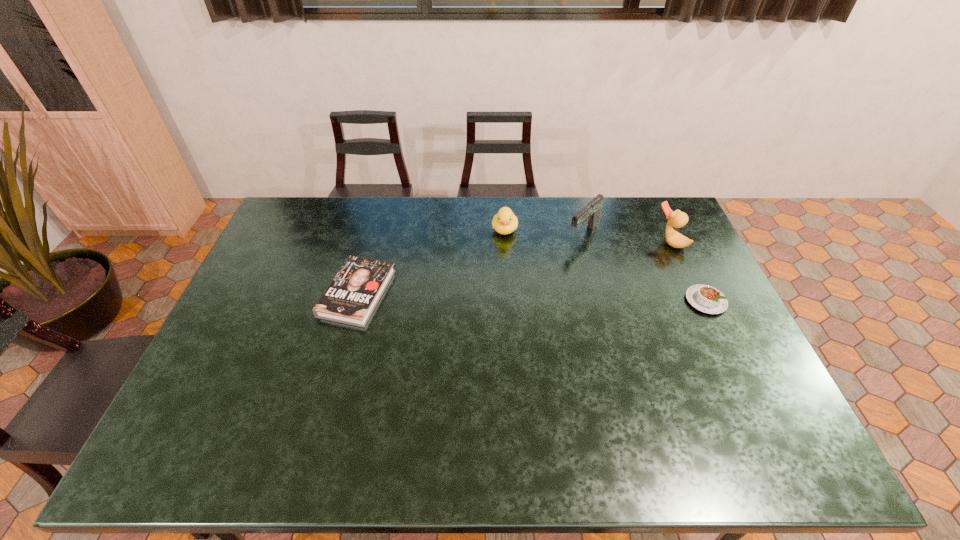
In order to click on duckling located at the far edge in this screenshot , I will do `click(504, 222)`.

At what (x,y) coordinates should I click in order to perform the action: click on pudding positioned at the right edge. Please return your answer as a coordinate pair (x, y). The height and width of the screenshot is (540, 960). Looking at the image, I should click on (707, 299).

You are a GUI agent. You are given a task and a screenshot of the screen. Output one action in this format:
    pyautogui.click(x=<x>, y=<y>)
    Task: Click on the duck located at the right edge
    This screenshot has width=960, height=540.
    Given the screenshot: What is the action you would take?
    pyautogui.click(x=677, y=219)

This screenshot has height=540, width=960. What are the coordinates of `object that is at the far right corner` in the screenshot? It's located at (677, 219).

You are a GUI agent. You are given a task and a screenshot of the screen. Output one action in this format:
    pyautogui.click(x=<x>, y=<y>)
    Task: Click on the free region at the far edge of the desktop
    The height and width of the screenshot is (540, 960).
    Given the screenshot: What is the action you would take?
    pyautogui.click(x=520, y=230)

The width and height of the screenshot is (960, 540). I want to click on vacant area at the near edge, so click(350, 387).

Identify the location of blank space at the left edge of the desktop. (304, 255).

In the image, there is a desktop. Where is `vacant space at the right edge`? vacant space at the right edge is located at coordinates (738, 382).

The width and height of the screenshot is (960, 540). In the image, there is a desktop. In order to click on free space at the far right corner in this screenshot , I will do `click(656, 222)`.

This screenshot has width=960, height=540. Find the location of `empty space between the pistol and the pudding`. empty space between the pistol and the pudding is located at coordinates (644, 267).